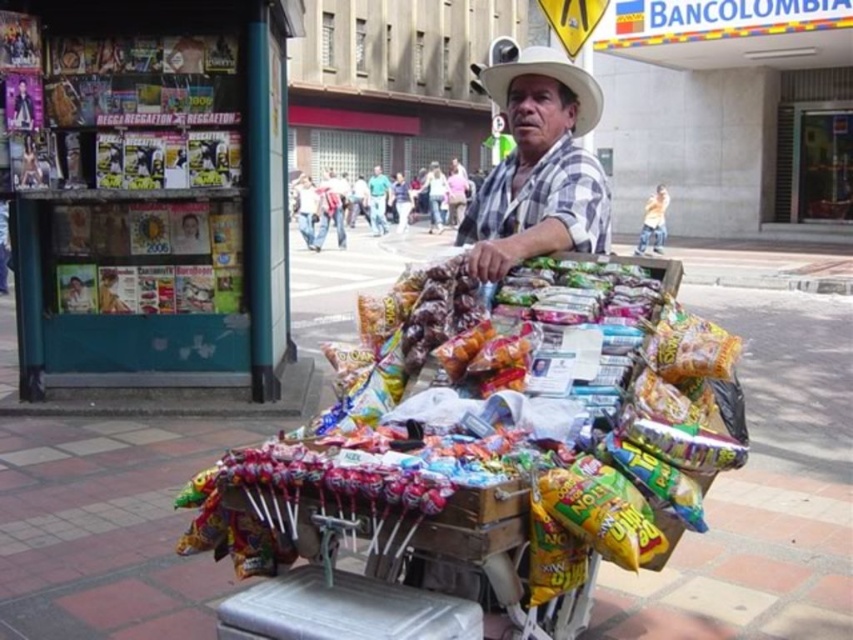
You are a customer standing at the entrance of the store. You see the white checkered shirt at center and the white felt cowboy hat at center. Which one is closer to you?

The white checkered shirt at center and the white felt cowboy hat at center are both at the same distance from you since they are both at center.

You are a customer looking at the white felt cowboy hat at center. Where exactly is it positioned relative to the teal kiosk on the left?

The white felt cowboy hat at center is located at point (548,76), so it is positioned to the right of the teal kiosk on the left.

You are a customer trying to reach the snacks on the wooden cart. You notice the white felt cowboy hat at center and the green fabric shirt at center. Which item is taller and would block your view more if you were standing in front of the cart?

The white felt cowboy hat at center is much taller than the green fabric shirt at center, so it would block your view more if you were standing in front of the cart.